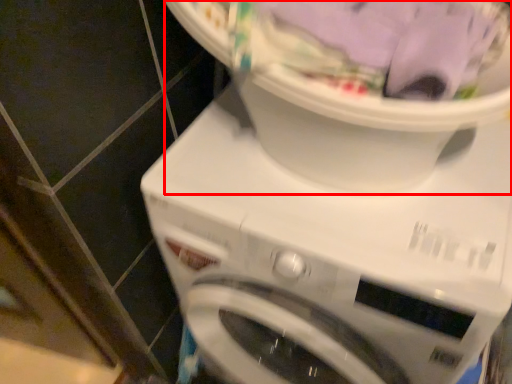
Question: From the image's perspective, what is the correct spatial relationship of machine (annotated by the red box) in relation to washing machine?

Choices:
 (A) above
 (B) below

Answer: (A)